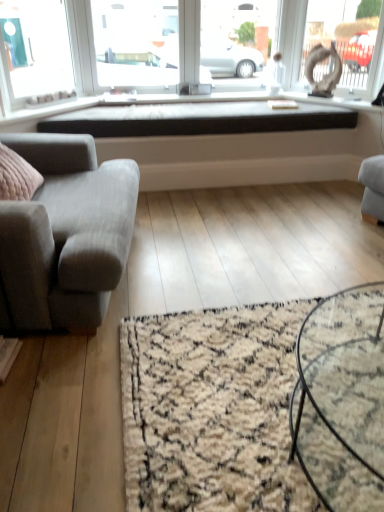
Question: Is point (150, 8) positioned closer to the camera than point (223, 384)?

Choices:
 (A) farther
 (B) closer

Answer: (A)

Question: From the image's perspective, is transparent glass window screen at upper center located above or below beige shaggy rug at lower center?

Choices:
 (A) above
 (B) below

Answer: (A)

Question: Estimate the real-world distances between objects in this image. Which object is closer to the matte white statue at upper right?

Choices:
 (A) beige shaggy rug at lower center
 (B) transparent glass window screen at upper center
 (C) gray fabric couch at left
 (D) black glass coffee table at center
 (E) black matte window sill at center

Answer: (B)

Question: Estimate the real-world distances between objects in this image. Which object is closer to the transparent glass window screen at upper center?

Choices:
 (A) beige shaggy rug at lower center
 (B) black matte window sill at center
 (C) matte white statue at upper right
 (D) gray fabric couch at left
 (E) black glass coffee table at center

Answer: (C)